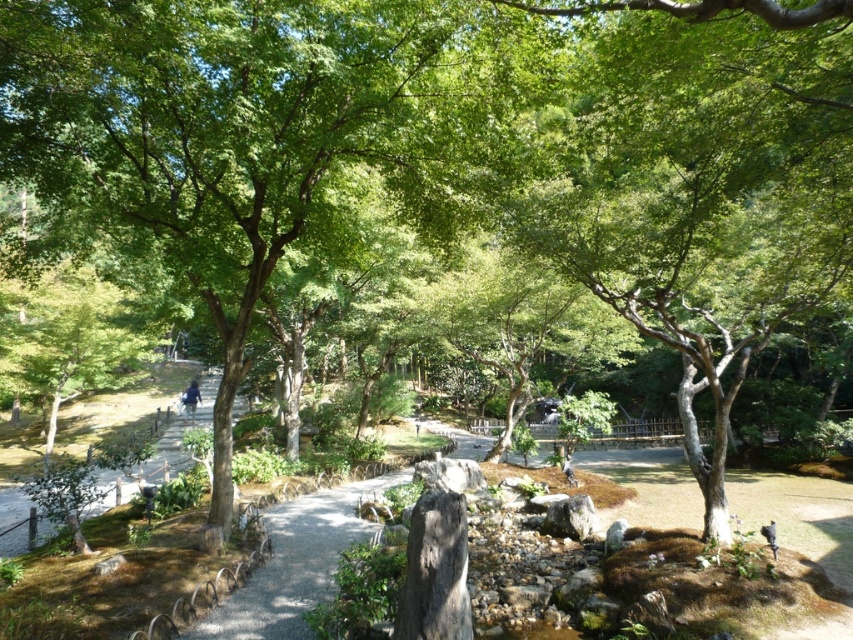
Question: Which object is the closest to the gravel path at center?

Choices:
 (A) dark brown wooden person at center
 (B) blue fabric person at lower center
 (C) gravel pathway at lower left

Answer: (A)

Question: Can you confirm if gravel pathway at lower left is wider than blue fabric person at lower center?

Choices:
 (A) no
 (B) yes

Answer: (B)

Question: Which is nearer to the gravel pathway at lower left?

Choices:
 (A) gravel path at center
 (B) blue fabric person at lower center
 (C) dark brown wooden person at center

Answer: (B)

Question: Does gravel path at center appear under dark brown wooden person at center?

Choices:
 (A) no
 (B) yes

Answer: (B)

Question: Which of the following is the farthest from the observer?

Choices:
 (A) blue fabric person at lower center
 (B) gravel path at center
 (C) gravel pathway at lower left
 (D) dark brown wooden person at center

Answer: (A)

Question: Is gravel path at center behind blue fabric person at lower center?

Choices:
 (A) no
 (B) yes

Answer: (A)